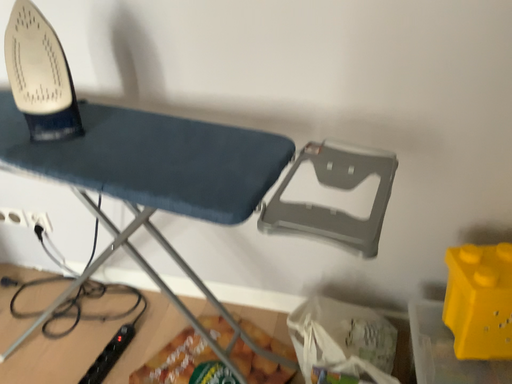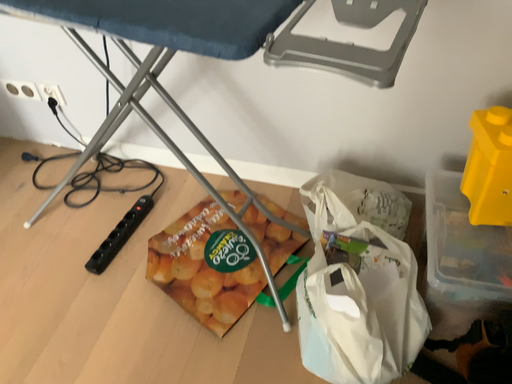
Question: Which way did the camera rotate in the video?

Choices:
 (A) rotated upward
 (B) rotated downward

Answer: (B)